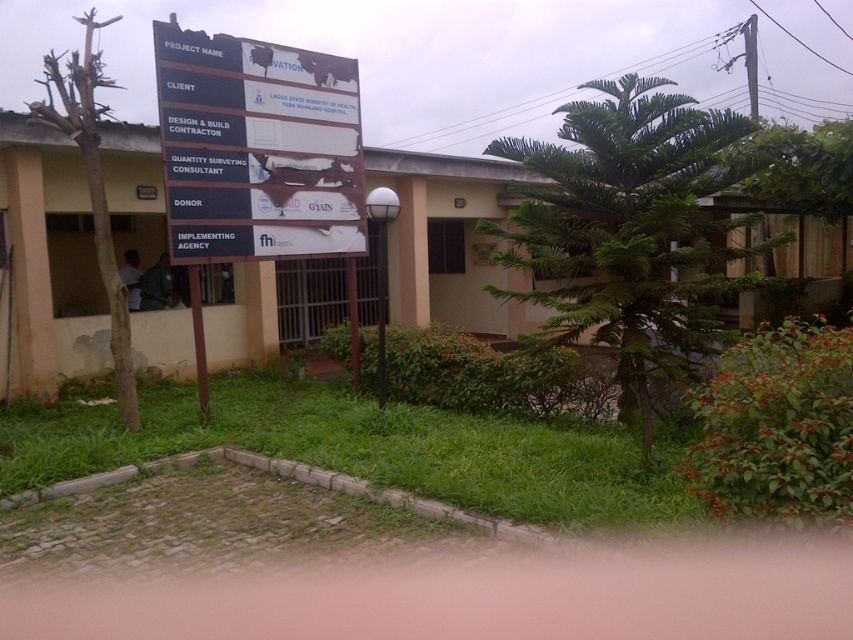
Question: In this image, where is green leafy tree at center located relative to white plastic sign at center?

Choices:
 (A) left
 (B) right

Answer: (B)

Question: Which point is closer to the camera?

Choices:
 (A) (619, 381)
 (B) (352, 106)

Answer: (A)

Question: Can you confirm if green leafy tree at center is smaller than white plastic sign at center?

Choices:
 (A) yes
 (B) no

Answer: (B)

Question: Is green leafy tree at center above white plastic sign at center?

Choices:
 (A) no
 (B) yes

Answer: (B)

Question: Among these objects, which one is farthest from the camera?

Choices:
 (A) white plastic sign at center
 (B) green leafy tree at center

Answer: (A)